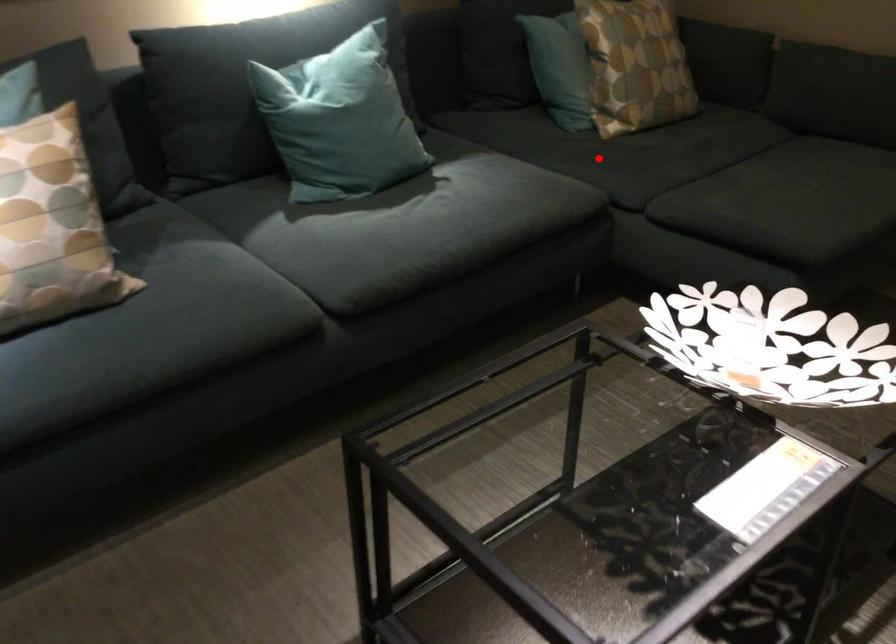
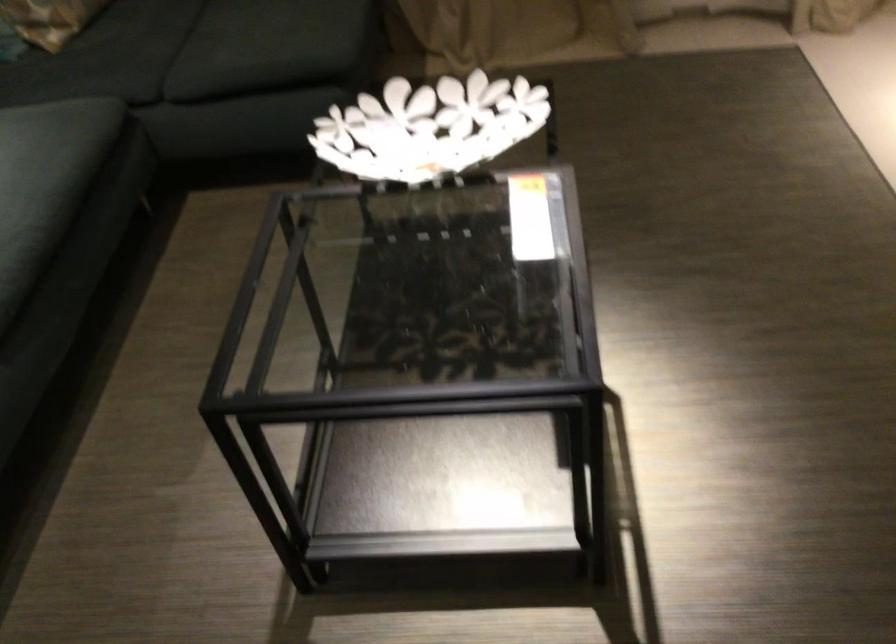
Locate, in the second image, the point that corresponds to the highlighted location in the first image.

(85, 73)